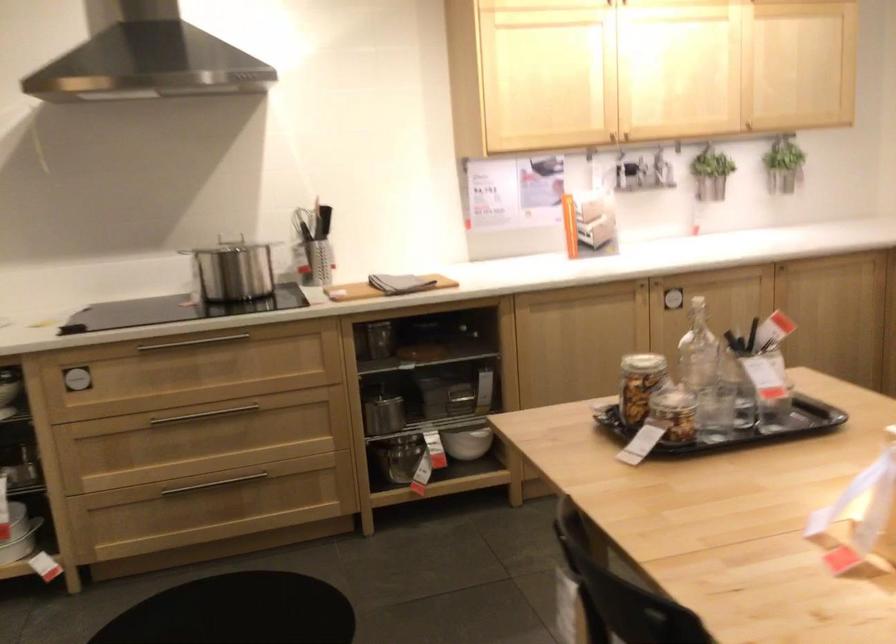
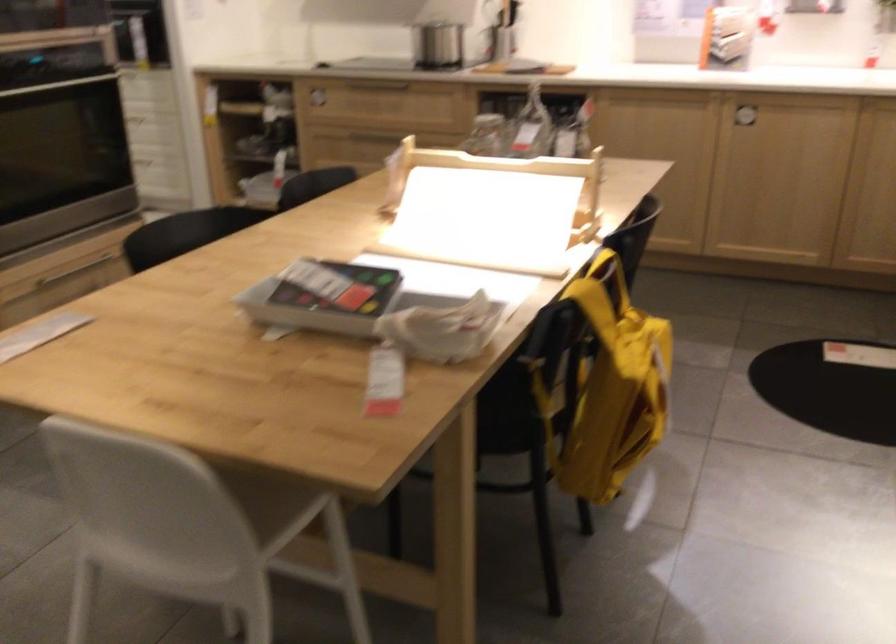
Question: I am providing you with two images of the same scene from different viewpoints. After the viewpoint changes to image2, which objects are now occluded?

Choices:
 (A) round metal handle
 (B) white bowl
 (C) cabinet handle
 (D) drawer handle

Answer: (B)